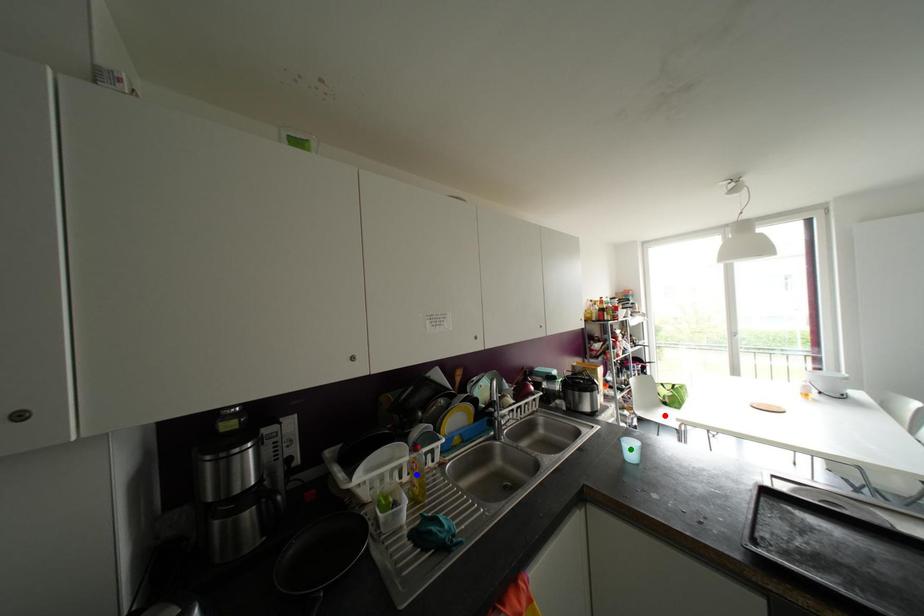
Order these from nearest to farthest:
red point
green point
blue point

red point, green point, blue point